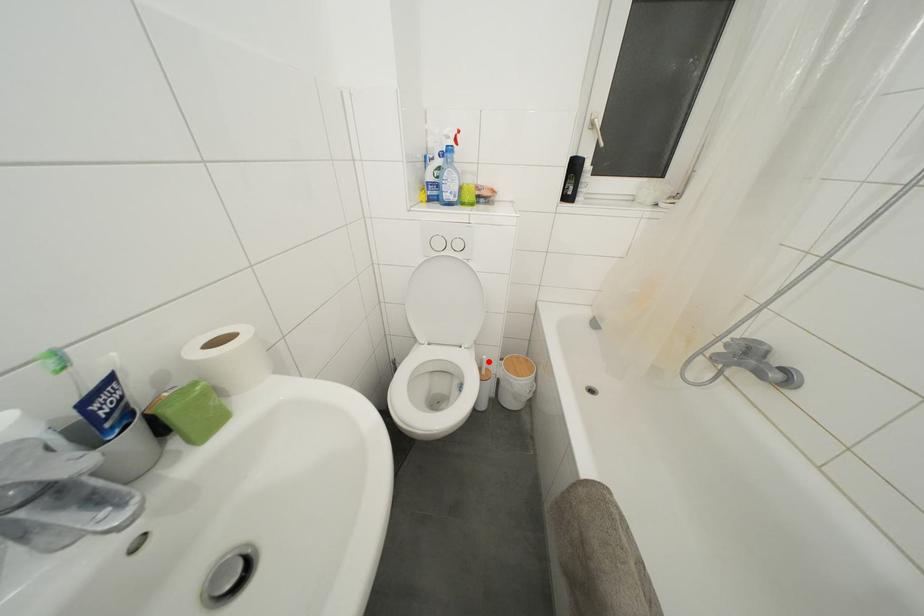
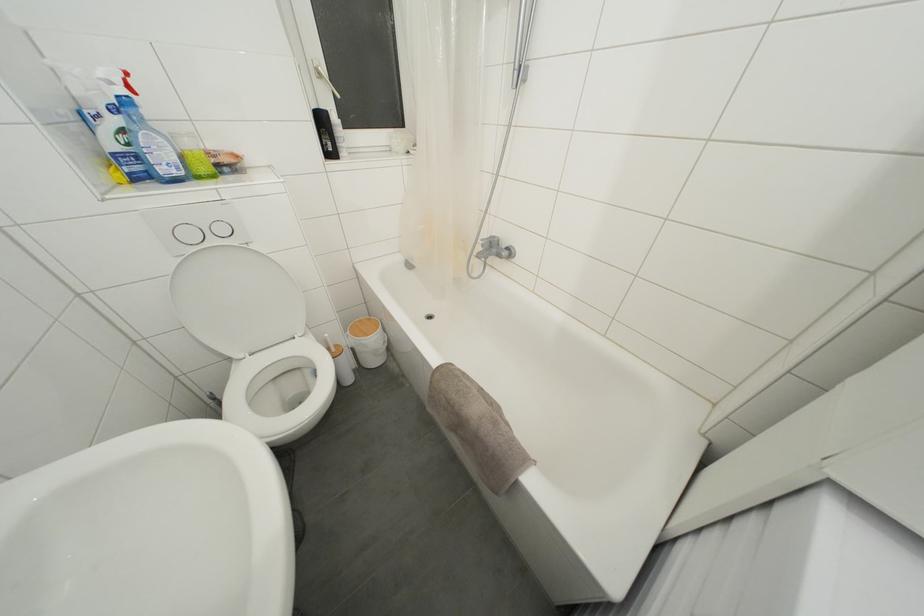
Question: I am providing you with two images of the same scene from different viewpoints. In image1, a red point is highlighted. Considering the same 3D point in image2, which of the following is correct?

Choices:
 (A) It is closer
 (B) It is farther

Answer: (A)